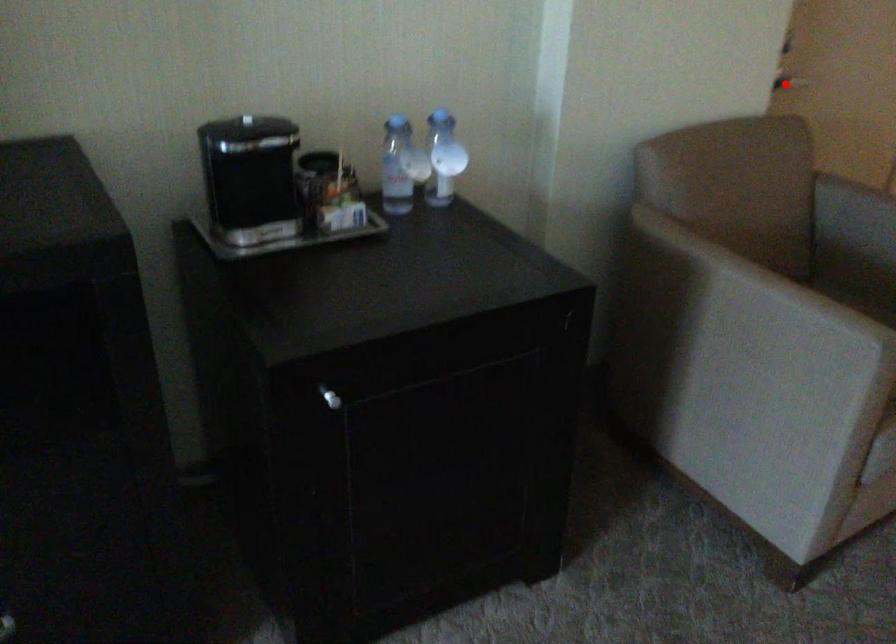
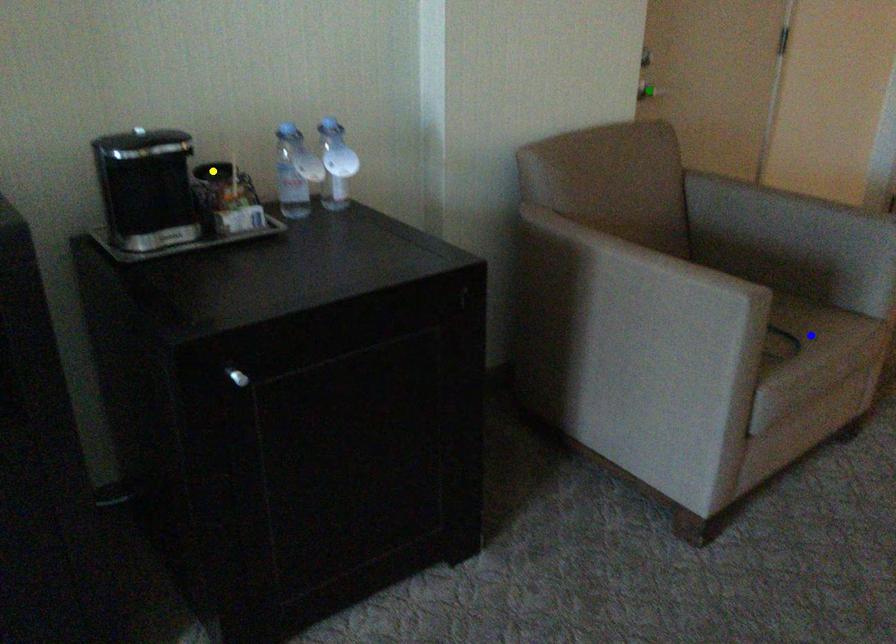
Question: I am providing you with two images of the same scene from different viewpoints. A red point is marked on the first image. You are given multiple points on the second image. Which spot in image 2 lines up with the point in image 1?

Choices:
 (A) green point
 (B) yellow point
 (C) blue point

Answer: (A)